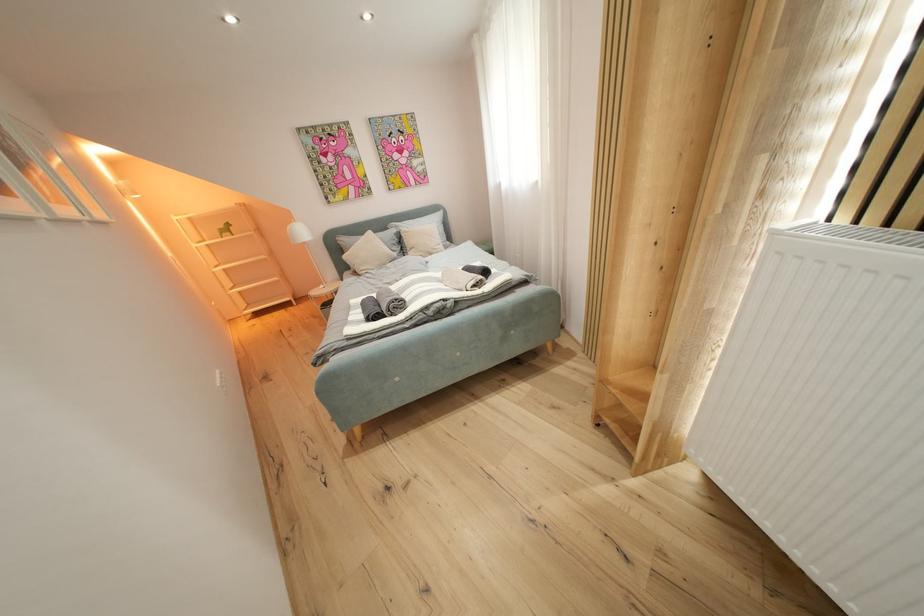
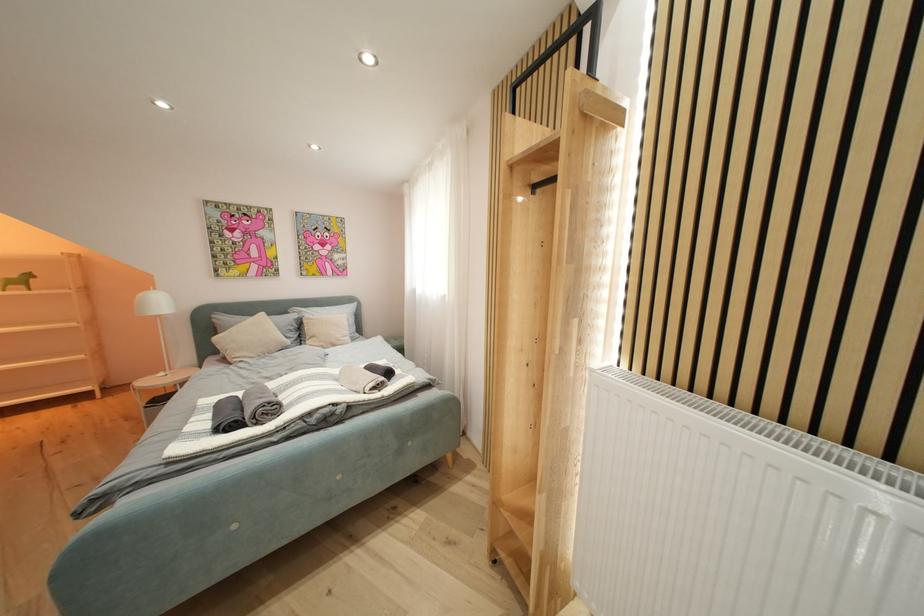
Based on the continuous images, in which direction is the camera rotating?

The camera rotated toward right-up.